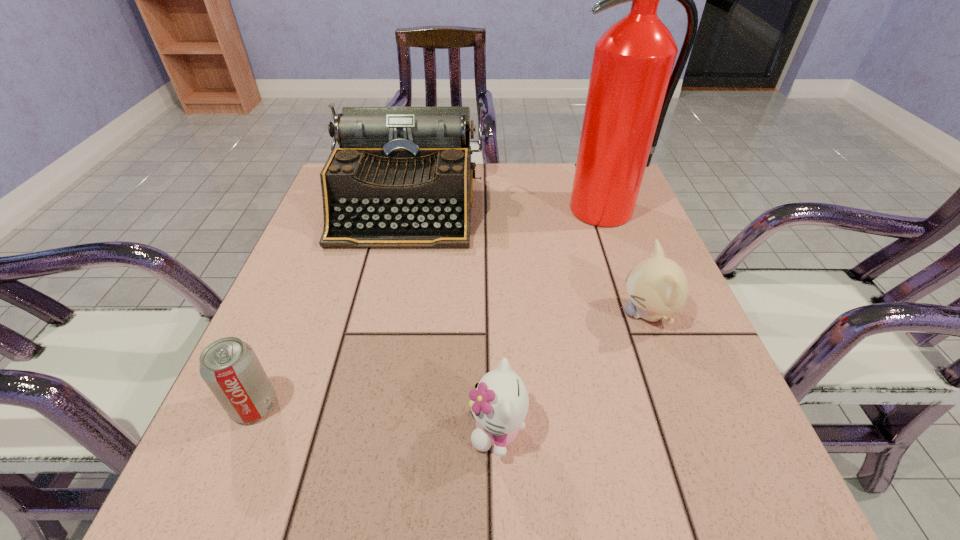
Locate an element on the screen. vacant area that lies between the second tallest object and the fire extinguisher is located at coordinates (505, 208).

Identify the location of free space between the third nearest object and the nearer kitten. Image resolution: width=960 pixels, height=540 pixels. (572, 372).

Where is `vacant space that's between the fire extinguisher and the nearer kitten`? Image resolution: width=960 pixels, height=540 pixels. vacant space that's between the fire extinguisher and the nearer kitten is located at coordinates (550, 320).

I want to click on unoccupied position between the second tallest object and the soda can, so click(x=330, y=306).

Where is `vacant area between the soda can and the nearer kitten`? The image size is (960, 540). vacant area between the soda can and the nearer kitten is located at coordinates (375, 417).

Where is `blank region between the nearer kitten and the soda can`? This screenshot has height=540, width=960. blank region between the nearer kitten and the soda can is located at coordinates (375, 417).

This screenshot has height=540, width=960. What are the coordinates of `vacant space in between the fire extinguisher and the second tallest object` in the screenshot? It's located at (505, 208).

I want to click on vacant area that lies between the nearer kitten and the soda can, so click(x=375, y=417).

Find the location of a particular element. The width and height of the screenshot is (960, 540). free spot between the soda can and the second tallest object is located at coordinates (330, 306).

You are a GUI agent. You are given a task and a screenshot of the screen. Output one action in this format:
    pyautogui.click(x=<x>, y=<y>)
    Task: Click on the free space between the soda can and the fire extinguisher
    This screenshot has height=540, width=960.
    Given the screenshot: What is the action you would take?
    pyautogui.click(x=429, y=307)